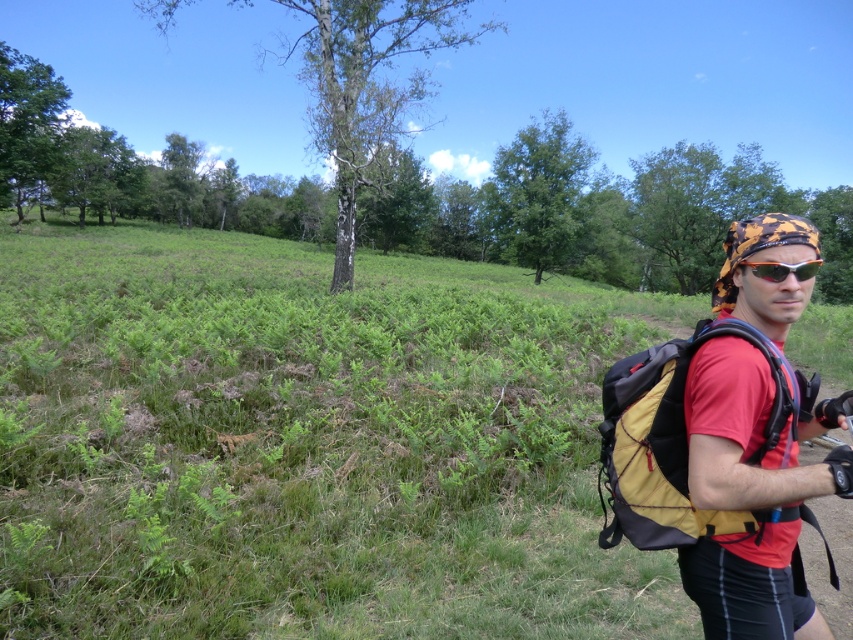
You are a hiker who wants to place your orange plastic goggles at center on the ground. Based on the scene, where should you place them so they are visible on the green grassy at center?

Place the orange plastic goggles at center on the green grassy at center so they are visible since the green grassy at center is positioned over the orange plastic goggles at center.

Based on the scene, which object occupies a larger area in the image, the green grassy at center or the yellow fabric backpack at right?

The green grassy at center is bigger than the yellow fabric backpack at right according to the description.